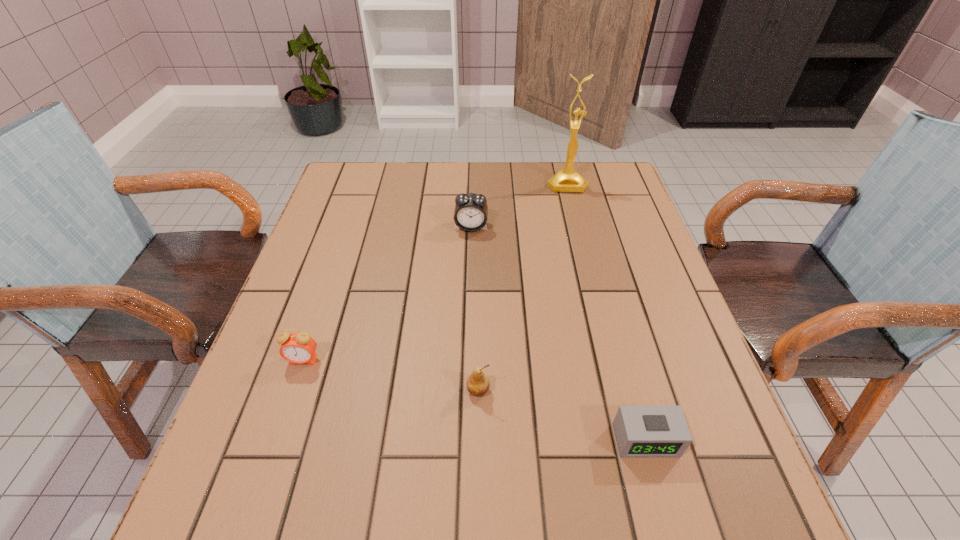
Identify the location of vacant region located on the front side of the second alarm clock from left to right. The image size is (960, 540). (469, 298).

This screenshot has height=540, width=960. What are the coordinates of `vacant area located 0.130m on the face of the leftmost alarm clock` in the screenshot? It's located at (280, 428).

Locate an element on the screen. The image size is (960, 540). free space located on the left of the fourth farthest object is located at coordinates (441, 390).

The height and width of the screenshot is (540, 960). Identify the location of vacant region located 0.050m on the front-facing side of the rightmost alarm clock. (659, 488).

Find the location of `object situated at the far edge`. object situated at the far edge is located at coordinates (565, 180).

The height and width of the screenshot is (540, 960). I want to click on object that is at the left edge, so click(x=299, y=348).

Identify the location of award that is at the right edge. The width and height of the screenshot is (960, 540). (565, 180).

I want to click on alarm clock located at the right edge, so click(642, 431).

Find the location of `object located in the far right corner section of the desktop`. object located in the far right corner section of the desktop is located at coordinates (565, 180).

This screenshot has width=960, height=540. Identify the location of vacant space at the far edge. (412, 195).